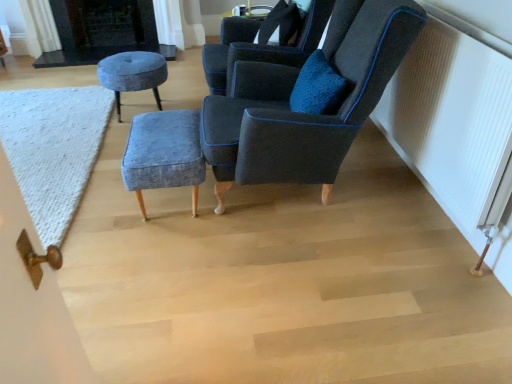
Locate an element on the screen. vacant area situated below white textured radiator at right (from a real-world perspective) is located at coordinates (424, 208).